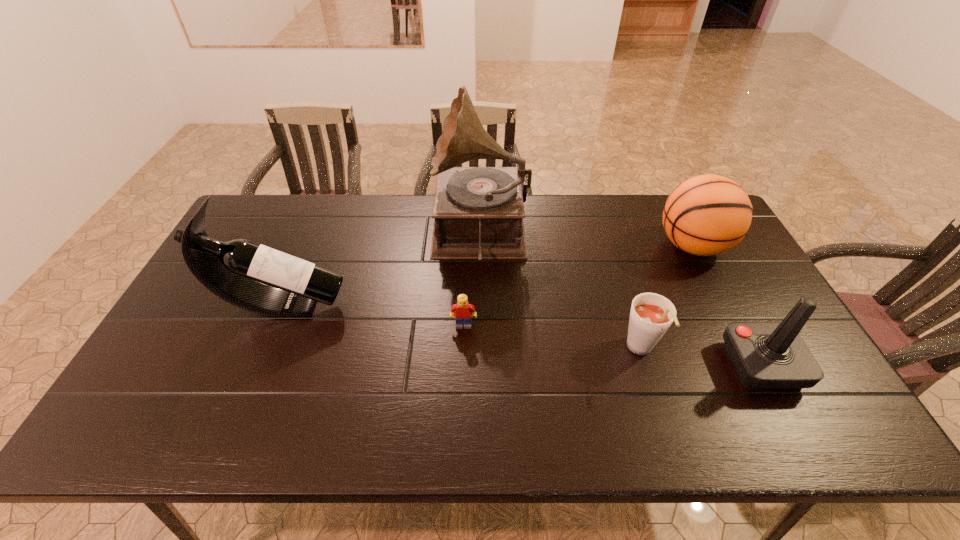
Where is `free location that satisfies the following two spatial constraints: 1. on the front-facing side of the joystick; 2. on the right side of the fourth farthest object`? The image size is (960, 540). free location that satisfies the following two spatial constraints: 1. on the front-facing side of the joystick; 2. on the right side of the fourth farthest object is located at coordinates (462, 366).

The width and height of the screenshot is (960, 540). I want to click on vacant position in the image that satisfies the following two spatial constraints: 1. from the horn of the joystick; 2. on the left side of the record player, so click(x=480, y=366).

Identify the location of free space that satisfies the following two spatial constraints: 1. on the drink side of the fourth object from left to right; 2. on the left side of the joystick. The image size is (960, 540). (645, 366).

Where is `free space that satisfies the following two spatial constraints: 1. from the horn of the record player; 2. on the right side of the joystick`? free space that satisfies the following two spatial constraints: 1. from the horn of the record player; 2. on the right side of the joystick is located at coordinates (480, 366).